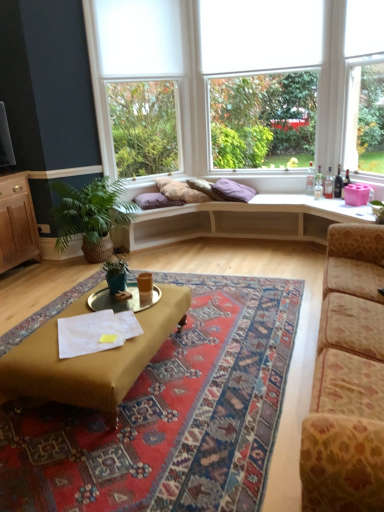
Where is `spots to the right of wooden cabinet at left`? The width and height of the screenshot is (384, 512). spots to the right of wooden cabinet at left is located at coordinates (39, 273).